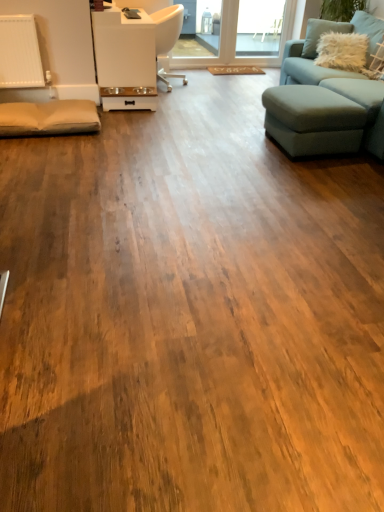
Question: Which is correct: transparent glass window at upper center is inside light blue fabric footrest at right, or outside of it?

Choices:
 (A) outside
 (B) inside

Answer: (A)

Question: Visually, is transparent glass window at upper center positioned to the left or to the right of light blue fabric footrest at right?

Choices:
 (A) left
 (B) right

Answer: (A)

Question: Which object is positioned closest to the transparent glass screen door at upper center?

Choices:
 (A) white glossy pet feeder at upper center
 (B) transparent glass window at upper center
 (C) teal fabric studio couch at right
 (D) light blue fabric footrest at right
 (E) white glossy chair at upper center

Answer: (B)

Question: Which object is positioned farthest from the white glossy pet feeder at upper center?

Choices:
 (A) teal fabric studio couch at right
 (B) white fluffy pillow at upper right
 (C) light blue fabric footrest at right
 (D) white glossy chair at upper center
 (E) transparent glass window at upper center

Answer: (E)